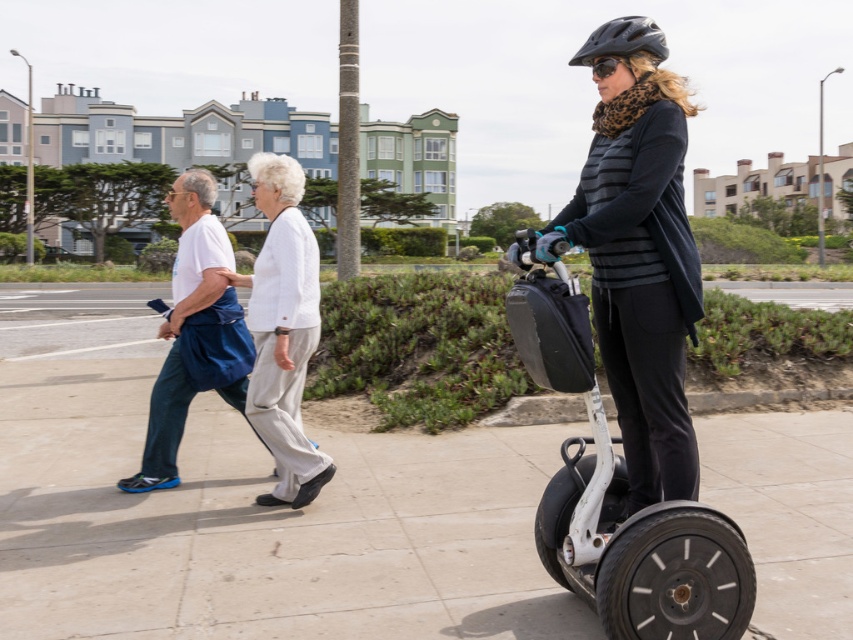
You are a delivery person with a cart that is 2 meters wide. You need to move from the elderly couple on the left to the Segway rider on the right. Is there enough space between the light gray concrete sidewalk at center to maneuver your cart?

The distance between the elderly couple on the left and the Segway rider on the right is 3.61 meters. Since the cart is 2 meters wide, there is sufficient space to maneuver between them on the light gray concrete sidewalk at center.

You are a pedestrian standing on the sidewalk. You see the white matte segway at center and the white cotton pants at center. Which object is closer to the ground?

The white matte segway at center is closer to the ground because it is positioned below the white cotton pants at center.

You are standing on the sidewalk and want to cross the street to reach a bench located 5 meters away. Can you safely cross the street without stepping off the light gray concrete sidewalk at center?

The light gray concrete sidewalk at center is 3.61 meters from viewer. Since the bench is 5 meters away, you would need to step off the sidewalk to reach it, so you cannot safely cross without leaving the sidewalk.